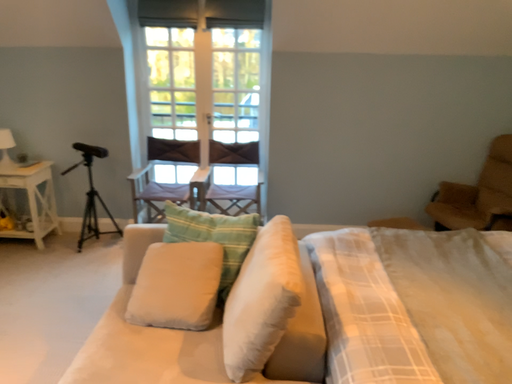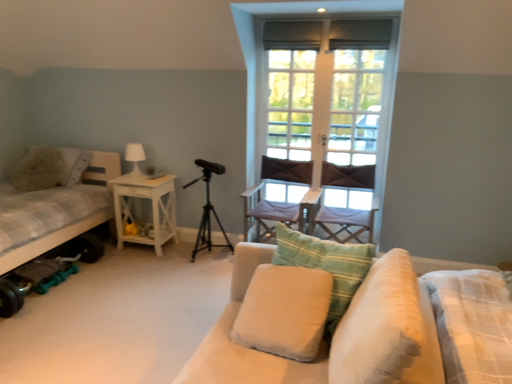
Question: Which way did the camera rotate in the video?

Choices:
 (A) rotated left
 (B) rotated right

Answer: (A)